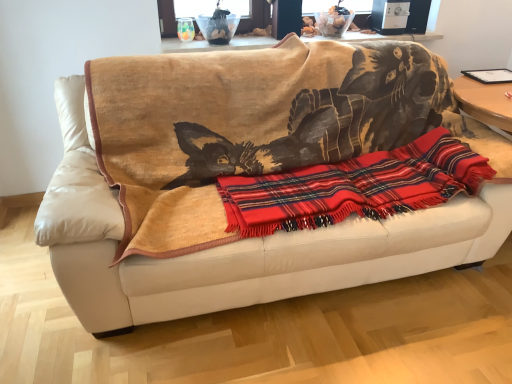
Question: Is wooden table at upper center bigger or smaller than red plaid blanket at center?

Choices:
 (A) big
 (B) small

Answer: (B)

Question: Is wooden table at upper center spatially inside red plaid blanket at center, or outside of it?

Choices:
 (A) inside
 (B) outside

Answer: (B)

Question: Which object is positioned closest to the red plaid blanket at center?

Choices:
 (A) wooden table at upper center
 (B) beige leather couch at center

Answer: (B)

Question: Which is farther from the wooden table at upper center?

Choices:
 (A) red plaid blanket at center
 (B) beige leather couch at center

Answer: (A)